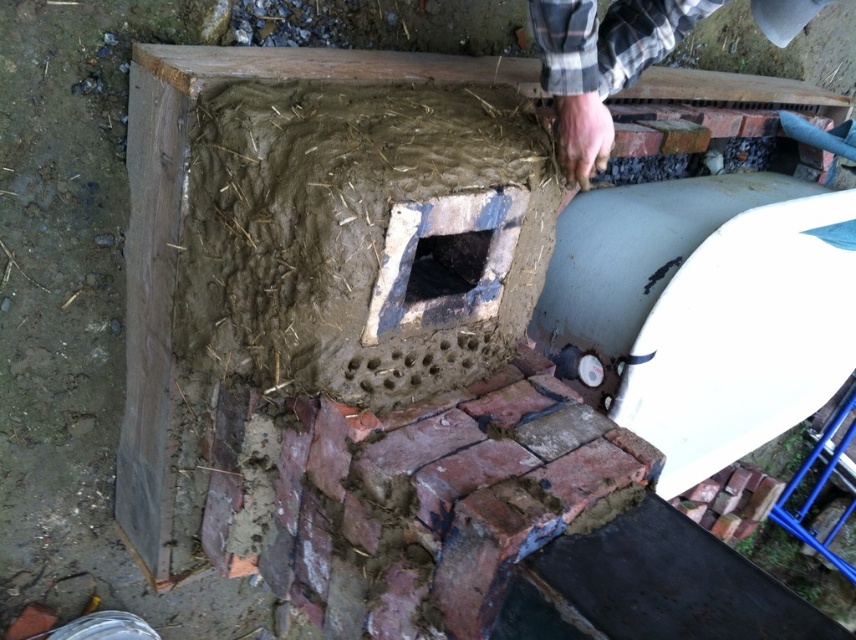
Question: Which object is farther from the camera taking this photo?

Choices:
 (A) plaid flannel shirt at upper right
 (B) black concrete hole at center

Answer: (A)

Question: Is plaid flannel shirt at upper right below black concrete hole at center?

Choices:
 (A) no
 (B) yes

Answer: (A)

Question: Which point is closer to the camera?

Choices:
 (A) black concrete hole at center
 (B) plaid flannel shirt at upper right

Answer: (A)

Question: Is plaid flannel shirt at upper right above black concrete hole at center?

Choices:
 (A) yes
 (B) no

Answer: (A)

Question: Is plaid flannel shirt at upper right to the left of black concrete hole at center from the viewer's perspective?

Choices:
 (A) yes
 (B) no

Answer: (B)